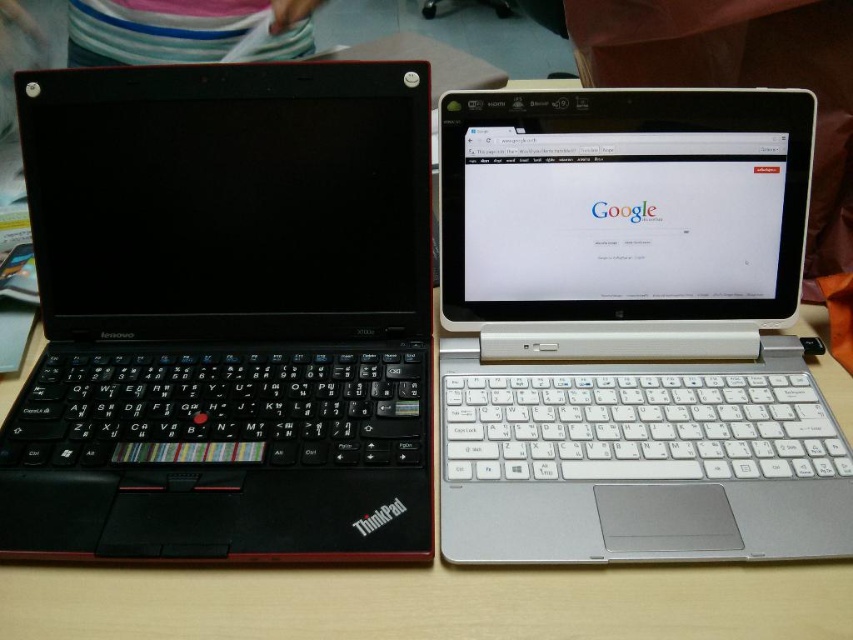
You are standing at the origin point in the image and want to reach the point at the end of the path. Which point should you go to first, point (352,252) or point (749,579)?

Answer: You should go to point (749,579) first because point (352,252) is behind point (749,579) from your current position at the origin.

You have a small toy car that is 4 inches long. You want to roll it from the white plastic laptop at center to the wooden table at center. Is there enough space for the toy car to move between them?

The white plastic laptop at center and wooden table at center are 4.38 inches apart, which is more than the 4 inch length of the toy car, so there is enough space for the toy car to move between them.

You are a delivery person who needs to place a small package on the light wooden surface between the two laptops. The package must be placed exactly at the point marked by point (224, 314). Which object from the scene does this point correspond to?

The point (224, 314) corresponds to the black matte keyboard at left.